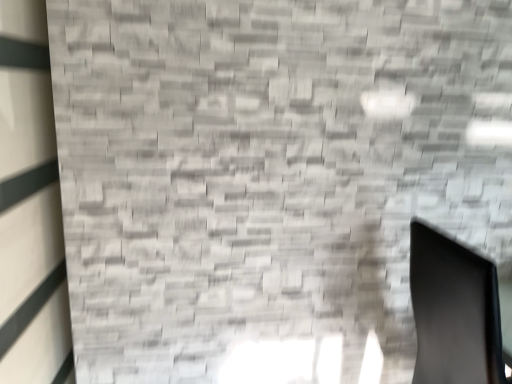
Question: Are matte gray brick wall at left and black matte swivel chair at lower right making contact?

Choices:
 (A) yes
 (B) no

Answer: (B)

Question: From a real-world perspective, is matte gray brick wall at left physically below black matte swivel chair at lower right?

Choices:
 (A) no
 (B) yes

Answer: (A)

Question: Is matte gray brick wall at left not near black matte swivel chair at lower right?

Choices:
 (A) no
 (B) yes

Answer: (B)

Question: Is the depth of matte gray brick wall at left less than that of black matte swivel chair at lower right?

Choices:
 (A) yes
 (B) no

Answer: (A)

Question: Does matte gray brick wall at left lie behind black matte swivel chair at lower right?

Choices:
 (A) no
 (B) yes

Answer: (A)

Question: From the image's perspective, would you say matte gray brick wall at left is positioned over black matte swivel chair at lower right?

Choices:
 (A) no
 (B) yes

Answer: (B)

Question: Is black matte swivel chair at lower right located outside matte gray brick wall at left?

Choices:
 (A) no
 (B) yes

Answer: (B)

Question: Does black matte swivel chair at lower right have a lesser height compared to matte gray brick wall at left?

Choices:
 (A) yes
 (B) no

Answer: (A)

Question: Does black matte swivel chair at lower right have a lesser width compared to matte gray brick wall at left?

Choices:
 (A) yes
 (B) no

Answer: (B)

Question: Can you confirm if black matte swivel chair at lower right is smaller than matte gray brick wall at left?

Choices:
 (A) no
 (B) yes

Answer: (A)

Question: From the image's perspective, is black matte swivel chair at lower right beneath matte gray brick wall at left?

Choices:
 (A) no
 (B) yes

Answer: (B)

Question: From a real-world perspective, is black matte swivel chair at lower right physically above matte gray brick wall at left?

Choices:
 (A) yes
 (B) no

Answer: (B)

Question: In terms of width, does matte gray brick wall at left look wider or thinner when compared to black matte swivel chair at lower right?

Choices:
 (A) wide
 (B) thin

Answer: (B)